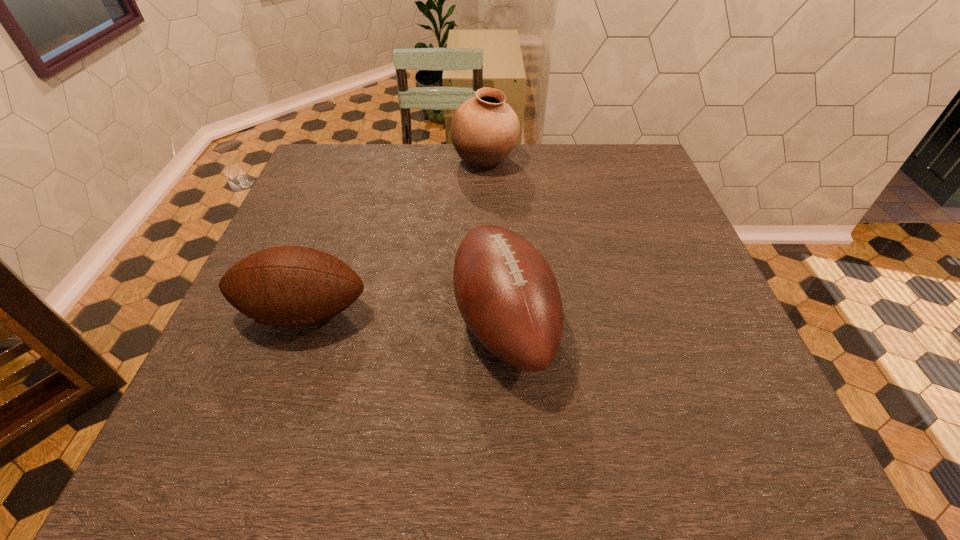
Locate which object is the closest to the shortest object. Please provide its 2D coordinates. Your answer should be formatted as a tuple, i.e. [(x, y)], where the tuple contains the x and y coordinates of a point satisfying the conditions above.

[(506, 292)]

The image size is (960, 540). In order to click on object that stands as the second closest to the farthest object in this screenshot , I will do `click(281, 286)`.

Where is `free space that satisfies the following two spatial constraints: 1. on the laces of the leftmost object; 2. on the left side of the right football`? This screenshot has height=540, width=960. free space that satisfies the following two spatial constraints: 1. on the laces of the leftmost object; 2. on the left side of the right football is located at coordinates (300, 322).

The height and width of the screenshot is (540, 960). Find the location of `vacant space that satisfies the following two spatial constraints: 1. on the laces of the taller football; 2. on the left side of the left football`. vacant space that satisfies the following two spatial constraints: 1. on the laces of the taller football; 2. on the left side of the left football is located at coordinates (300, 322).

Where is `vacant position in the image that satisfies the following two spatial constraints: 1. on the laces of the shorter football; 2. on the left side of the right football`? vacant position in the image that satisfies the following two spatial constraints: 1. on the laces of the shorter football; 2. on the left side of the right football is located at coordinates (300, 322).

This screenshot has width=960, height=540. What are the coordinates of `vacant space that satisfies the following two spatial constraints: 1. on the laces of the taller football; 2. on the right side of the shortest object` in the screenshot? It's located at (300, 322).

Where is `vacant region that satisfies the following two spatial constraints: 1. on the laces of the right football; 2. on the left side of the shortest object`? vacant region that satisfies the following two spatial constraints: 1. on the laces of the right football; 2. on the left side of the shortest object is located at coordinates (300, 322).

You are a GUI agent. You are given a task and a screenshot of the screen. Output one action in this format:
    pyautogui.click(x=<x>, y=<y>)
    Task: Click on the vacant space that satisfies the following two spatial constraints: 1. on the laces of the shortest object; 2. on the right side of the taller football
    This screenshot has width=960, height=540.
    Given the screenshot: What is the action you would take?
    pyautogui.click(x=300, y=322)